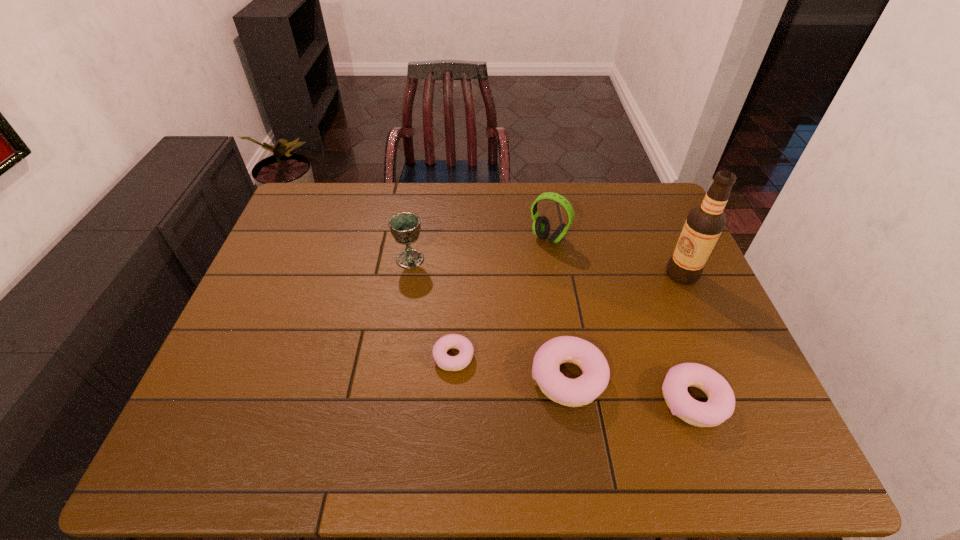
Image resolution: width=960 pixels, height=540 pixels. Find the location of `the leftmost doughnut`. the leftmost doughnut is located at coordinates (449, 363).

Find the location of a particular element. This screenshot has height=540, width=960. the shortest doughnut is located at coordinates (449, 363).

At what (x,y) coordinates should I click in order to perform the action: click on the second doughnut from right to left. Please return your answer as a coordinate pair (x, y). Image resolution: width=960 pixels, height=540 pixels. Looking at the image, I should click on (583, 390).

Find the location of a particular element. the fifth tallest object is located at coordinates (720, 406).

This screenshot has height=540, width=960. I want to click on the second tallest doughnut, so click(720, 406).

Image resolution: width=960 pixels, height=540 pixels. In order to click on headset in this screenshot , I will do `click(541, 227)`.

Image resolution: width=960 pixels, height=540 pixels. What are the coordinates of `the leftmost object` in the screenshot? It's located at (405, 227).

You are a GUI agent. You are given a task and a screenshot of the screen. Output one action in this format:
    pyautogui.click(x=<x>, y=<y>)
    Task: Click on the tallest object
    
    Given the screenshot: What is the action you would take?
    pyautogui.click(x=704, y=224)

Find the location of a particular element. Image resolution: width=960 pixels, height=540 pixels. vacant region located 0.290m on the back of the shortest object is located at coordinates (458, 261).

In order to click on free region located on the right of the second doughnut from right to left in this screenshot , I will do `click(644, 378)`.